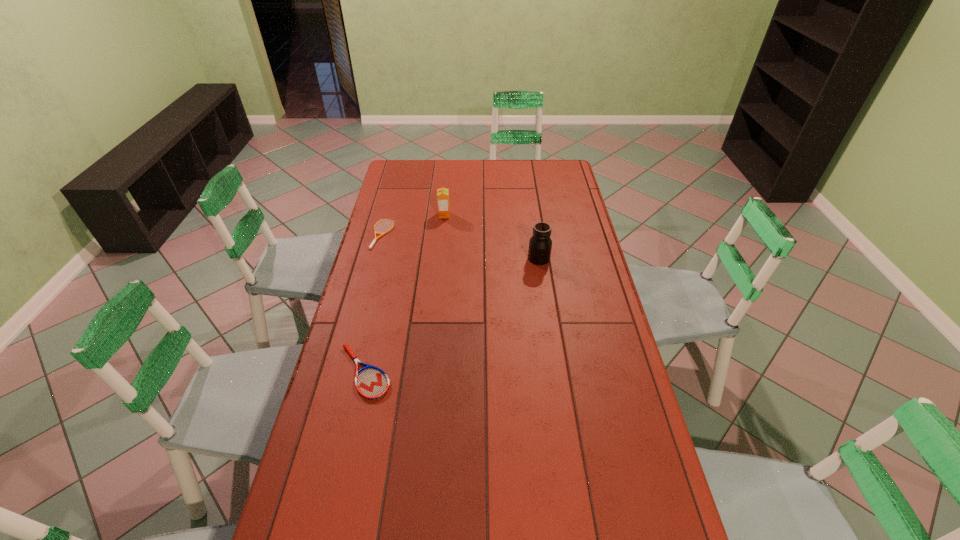
At what (x,y) coordinates should I click in order to perform the action: click on free spot between the nearer tennis racket and the shortest object. Please return your answer as a coordinate pair (x, y). Looking at the image, I should click on (373, 303).

Where is `vacant area that lies between the nearer tennis racket and the jar`? vacant area that lies between the nearer tennis racket and the jar is located at coordinates (452, 315).

Identify the location of vacant region between the third nearest object and the orange juice. (414, 225).

This screenshot has height=540, width=960. Identify the location of vacant point located between the second nearest object and the nearer tennis racket. (452, 315).

Identify the location of blank region between the nearer tennis racket and the jar. Image resolution: width=960 pixels, height=540 pixels. (452, 315).

Identify the location of free space that is in between the nearest object and the third farthest object. (452, 315).

Identify which object is the third nearest to the farther tennis racket. Please provide its 2D coordinates. Your answer should be formatted as a tuple, i.e. [(x, y)], where the tuple contains the x and y coordinates of a point satisfying the conditions above.

[(540, 244)]

The image size is (960, 540). Identify the location of the third closest object to the second object from right to left. (372, 383).